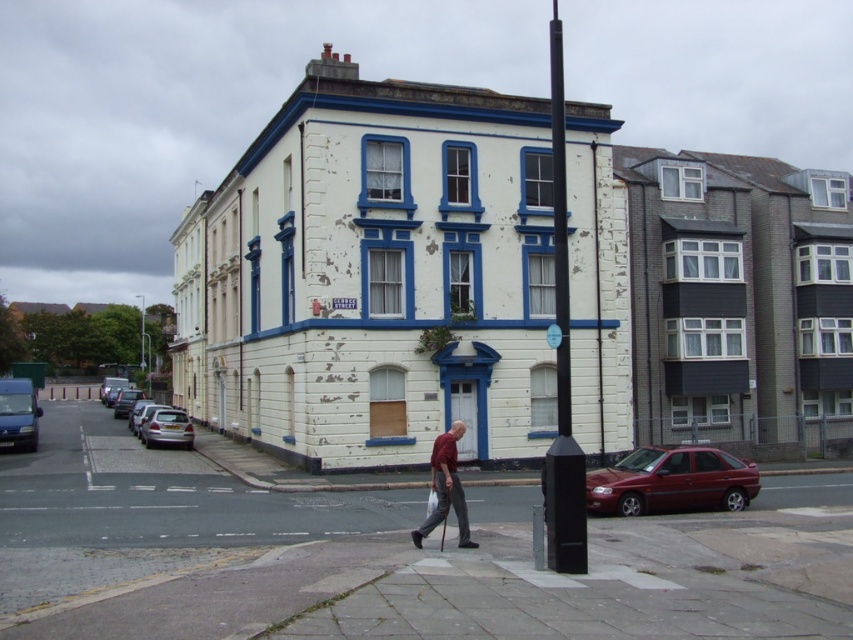
In the scene shown: You are driving a car and see the silver metallic hatchback at lower left and the white plastic street sign at center. Which object is smaller in size?

The silver metallic hatchback at lower left is smaller than the white plastic street sign at center.

You are a city planner evaluating the street layout. You need to install a new traffic light that must be at least 2 meters taller than the tallest object in the area. Given the black plastic pole at center and the white plastic street sign at center, which object determines the minimum height requirement for the new traffic light?

The black plastic pole at center is much taller than the white plastic street sign at center, so the minimum height requirement for the new traffic light must be at least 2 meters taller than the black plastic pole at center.